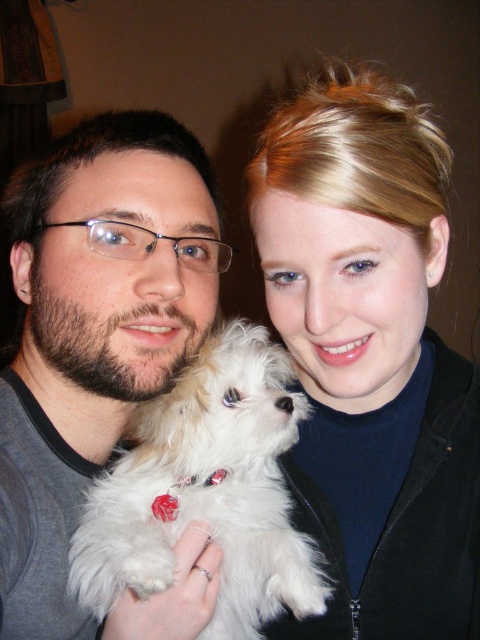
You are a photographer setting up a photo shoot. You need to ensure that the matte white dog at upper right and the matte gray shirt at center are visible in the frame. Based on their heights, which object will require more vertical space in the camera frame?

The matte white dog at upper right is taller than the matte gray shirt at center, so it will require more vertical space in the camera frame.

You are a photographer setting up for a group photo. You have a matte white dog at upper right and a matte gray shirt at center in your frame. Which object is smaller in size?

The matte white dog at upper right is smaller than the matte gray shirt at center.

You are standing in the room and see two points marked on the floor. The first point is at point (264, 164) and the second is at point (236, 333). Which point is closer to you?

Point (264, 164) is in front of point (236, 333), so it is closer to you.